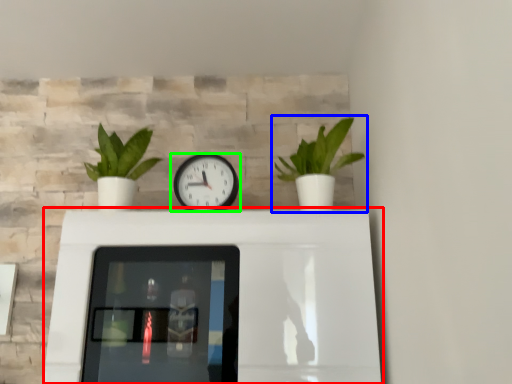
Question: Based on their relative distances, which object is farther from table (highlighted by a red box)? Choose from houseplant (highlighted by a blue box) and wall clock (highlighted by a green box).

Choices:
 (A) houseplant
 (B) wall clock

Answer: (A)